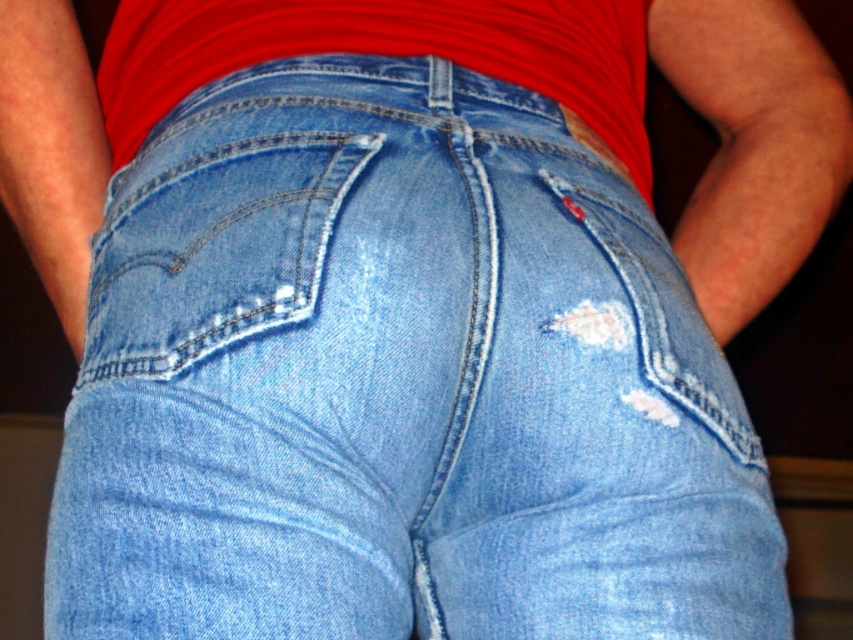
Does light blue denim pocket at center have a larger size compared to red cotton shirt at center?

No, light blue denim pocket at center is not bigger than red cotton shirt at center.

Does light blue denim pocket at center appear on the left side of red cotton shirt at center?

Correct, you'll find light blue denim pocket at center to the left of red cotton shirt at center.

What do you see at coordinates (213, 248) in the screenshot?
I see `light blue denim pocket at center` at bounding box center [213, 248].

Find the location of a particular element. The image size is (853, 640). light blue denim pocket at center is located at coordinates (213, 248).